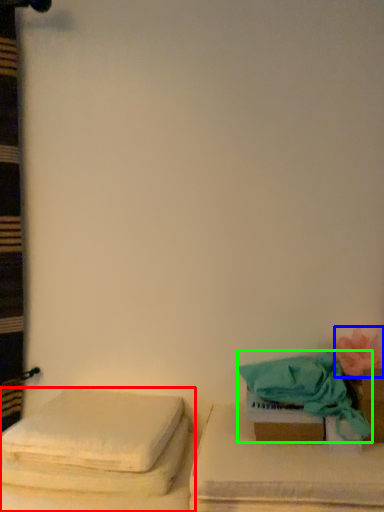
Question: Which object is positioned closest to furniture (highlighted by a red box)? Select from flower (highlighted by a blue box) and beach towel (highlighted by a green box).

Choices:
 (A) flower
 (B) beach towel

Answer: (B)